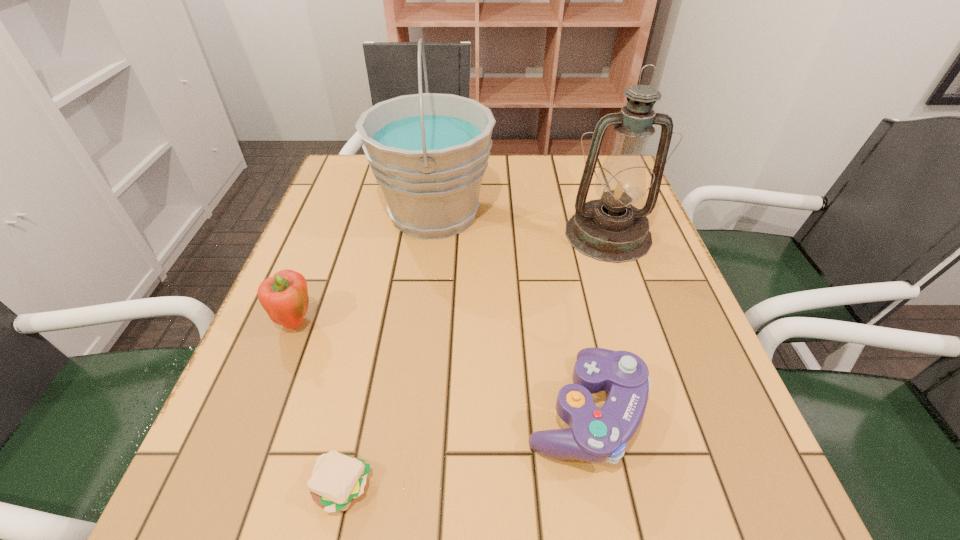
Find the location of `vacant area at the near edge`. vacant area at the near edge is located at coordinates (485, 478).

This screenshot has height=540, width=960. In the image, there is a desktop. In order to click on vacant space at the left edge in this screenshot , I will do `click(310, 256)`.

In the image, there is a desktop. At what (x,y) coordinates should I click in order to perform the action: click on free space at the right edge. Please return your answer as a coordinate pair (x, y). The image size is (960, 540). Looking at the image, I should click on (667, 372).

In the image, there is a desktop. Where is `free space at the far left corner`? This screenshot has height=540, width=960. free space at the far left corner is located at coordinates (364, 191).

Image resolution: width=960 pixels, height=540 pixels. In order to click on vacant region at the near right corner of the desktop in this screenshot , I will do `click(714, 471)`.

Find the location of a particular element. This screenshot has width=960, height=540. free space that is in between the fourth tallest object and the pepper is located at coordinates (441, 367).

The image size is (960, 540). I want to click on free spot between the pepper and the bucket, so click(365, 268).

Identify the location of free space between the oil lamp and the shortest object. The height and width of the screenshot is (540, 960). (475, 361).

Identify the location of empty space that is in between the patty and the leftmost object. The height and width of the screenshot is (540, 960). (319, 405).

Find the location of a particular element. free space between the bucket and the control is located at coordinates (510, 312).